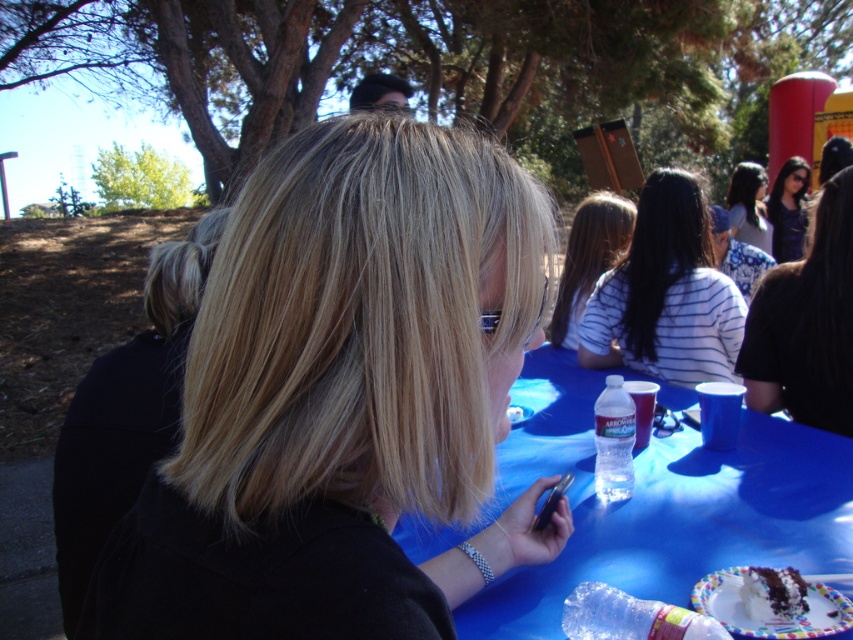
Can you confirm if blonde hair at center is bigger than chocolate frosted cake at lower right?

Correct, blonde hair at center is larger in size than chocolate frosted cake at lower right.

Is blonde hair at center to the right of chocolate frosted cake at lower right from the viewer's perspective?

In fact, blonde hair at center is to the left of chocolate frosted cake at lower right.

Is point (415, 566) positioned behind point (756, 605)?

No.

What are the coordinates of `blonde hair at center` in the screenshot? It's located at (343, 397).

Who is more forward, (790, 467) or (840, 145)?

Positioned in front is point (790, 467).

This screenshot has width=853, height=640. Identify the location of blue plastic table at center. (650, 506).

Is dark brown hair at upper right behind striped fabric shirt at center?

No, dark brown hair at upper right is closer to the viewer.

Which of these two, dark brown hair at upper right or striped fabric shirt at center, stands taller?

dark brown hair at upper right is taller.

Between point (802, 262) and point (579, 209), which one is positioned in front?

Point (802, 262) is more forward.

Locate an element on the screen. dark brown hair at upper right is located at coordinates (805, 324).